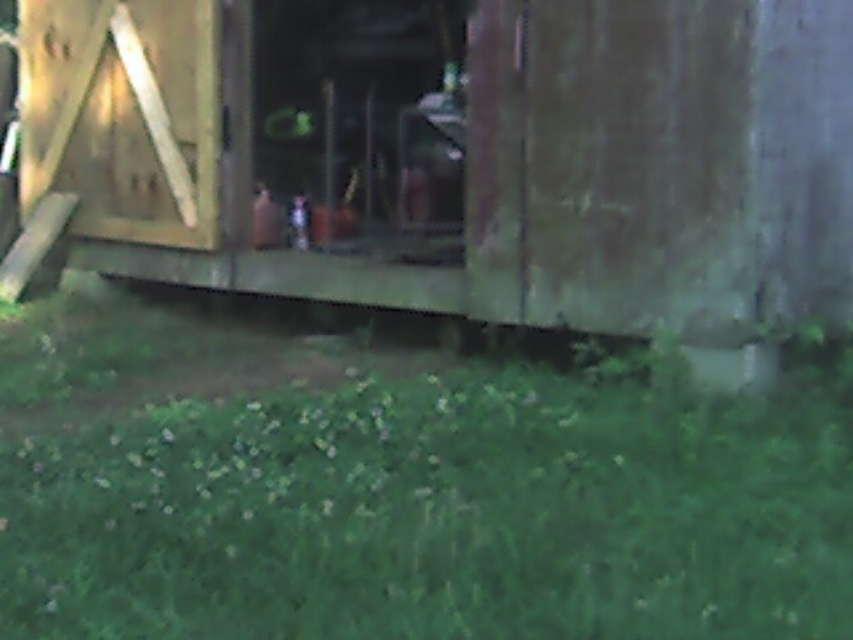
Question: Is green grass at lower center to the right of wooden hut at center from the viewer's perspective?

Choices:
 (A) yes
 (B) no

Answer: (B)

Question: Does green grass at lower center lie in front of wooden hut at center?

Choices:
 (A) yes
 (B) no

Answer: (A)

Question: Which point appears farthest from the camera in this image?

Choices:
 (A) (769, 413)
 (B) (71, 60)

Answer: (B)

Question: Which point appears farthest from the camera in this image?

Choices:
 (A) (115, 3)
 (B) (840, 422)

Answer: (A)

Question: Can you confirm if green grass at lower center is positioned to the right of wooden hut at center?

Choices:
 (A) no
 (B) yes

Answer: (A)